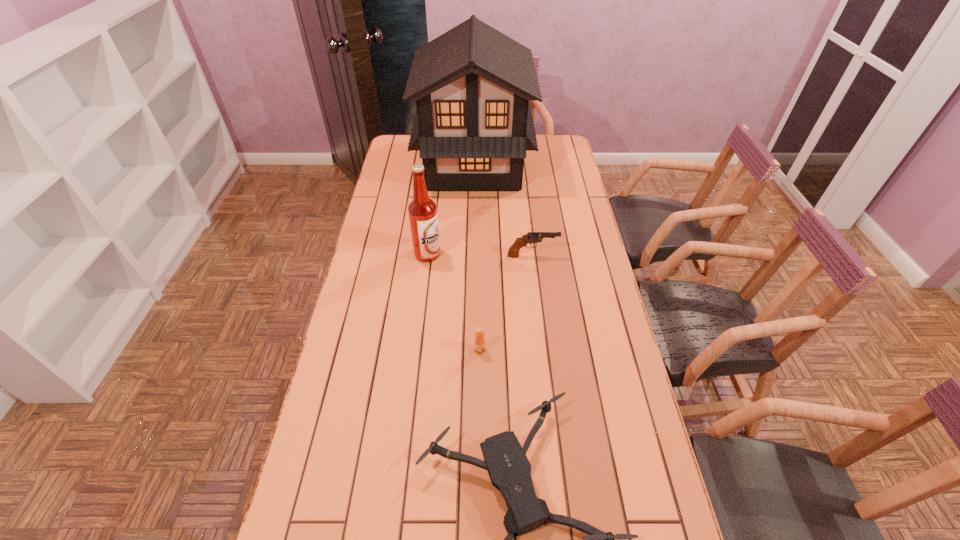
This screenshot has width=960, height=540. In order to click on object that is at the left edge in this screenshot , I will do `click(473, 124)`.

In order to click on object positioned at the right edge in this screenshot , I will do `click(531, 237)`.

Locate an element on the screen. The width and height of the screenshot is (960, 540). object present at the far left corner is located at coordinates (473, 124).

Find the location of `blank area at the left edge`. blank area at the left edge is located at coordinates (400, 184).

This screenshot has width=960, height=540. What are the coordinates of `free space at the right edge of the desktop` in the screenshot? It's located at (585, 300).

I want to click on vacant region between the fourth farthest object and the gun, so click(x=506, y=303).

The width and height of the screenshot is (960, 540). Identify the location of free spot between the tallest object and the orange juice. (477, 258).

Identify the location of object identified as the second closest to the drone. (422, 211).

Select which object appears as the second closest to the shortest object. Please provide its 2D coordinates. Your answer should be formatted as a tuple, i.e. [(x, y)], where the tuple contains the x and y coordinates of a point satisfying the conditions above.

[(422, 211)]